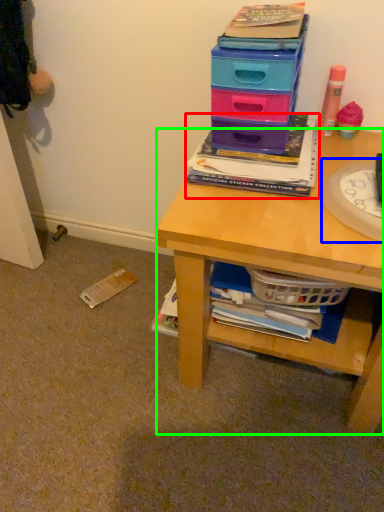
Question: Based on their relative distances, which object is nearer to book (highlighted by a red box)? Choose from paper plate (highlighted by a blue box) and desk (highlighted by a green box).

Choices:
 (A) paper plate
 (B) desk

Answer: (A)